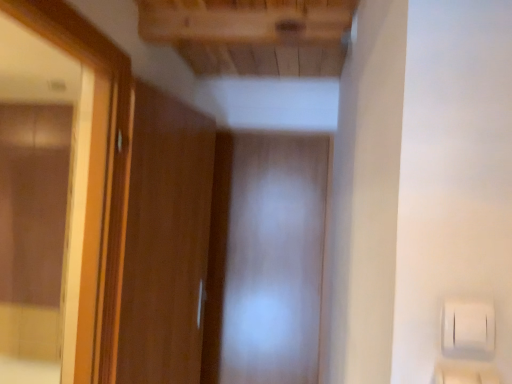
Question: Would you say wooden frame mirror at left is a long distance from wooden door at left?

Choices:
 (A) yes
 (B) no

Answer: (B)

Question: Can you confirm if wooden frame mirror at left is taller than wooden door at left?

Choices:
 (A) yes
 (B) no

Answer: (B)

Question: Does wooden frame mirror at left have a larger size compared to wooden door at left?

Choices:
 (A) yes
 (B) no

Answer: (A)

Question: Is wooden frame mirror at left positioned with its back to wooden door at left?

Choices:
 (A) no
 (B) yes

Answer: (A)

Question: Does wooden frame mirror at left appear on the left side of wooden door at left?

Choices:
 (A) no
 (B) yes

Answer: (B)

Question: From a real-world perspective, is wooden door at left positioned above or below wooden frame mirror at left?

Choices:
 (A) below
 (B) above

Answer: (A)

Question: Is wooden door at left to the left or to the right of wooden frame mirror at left in the image?

Choices:
 (A) right
 (B) left

Answer: (A)

Question: Is wooden door at left in front of or behind wooden frame mirror at left in the image?

Choices:
 (A) behind
 (B) front

Answer: (A)

Question: Looking at their shapes, would you say wooden door at left is wider or thinner than wooden frame mirror at left?

Choices:
 (A) wide
 (B) thin

Answer: (B)

Question: Is point (224, 299) closer or farther from the camera than point (66, 326)?

Choices:
 (A) farther
 (B) closer

Answer: (A)

Question: From a real-world perspective, is transparent plastic screen door at center physically located above or below wooden frame mirror at left?

Choices:
 (A) above
 (B) below

Answer: (B)

Question: Is transparent plastic screen door at center spatially inside wooden frame mirror at left, or outside of it?

Choices:
 (A) outside
 (B) inside

Answer: (A)

Question: Based on their sizes in the image, would you say transparent plastic screen door at center is bigger or smaller than wooden frame mirror at left?

Choices:
 (A) big
 (B) small

Answer: (B)

Question: From a real-world perspective, is wooden door at left physically located above or below transparent plastic screen door at center?

Choices:
 (A) below
 (B) above

Answer: (B)

Question: Considering the positions of wooden door at left and transparent plastic screen door at center in the image, is wooden door at left bigger or smaller than transparent plastic screen door at center?

Choices:
 (A) small
 (B) big

Answer: (B)